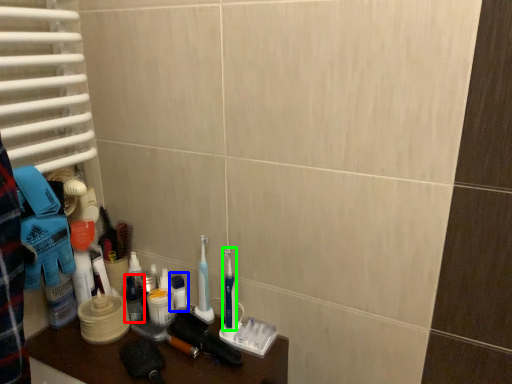
Question: Which object is positioned closest to toiletry (highlighted by a red box)? Select from toiletry (highlighted by a blue box) and toothbrush (highlighted by a green box).

Choices:
 (A) toiletry
 (B) toothbrush

Answer: (A)